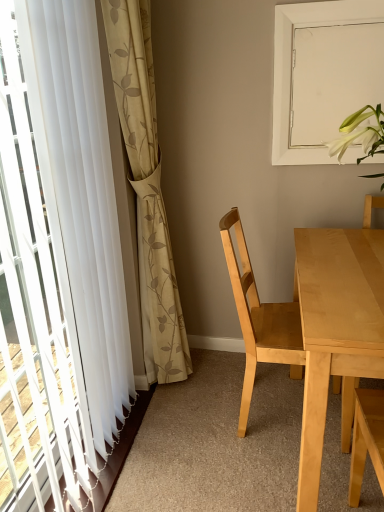
The height and width of the screenshot is (512, 384). I want to click on vacant space situated above light wood table at right (from a real-world perspective), so click(x=344, y=267).